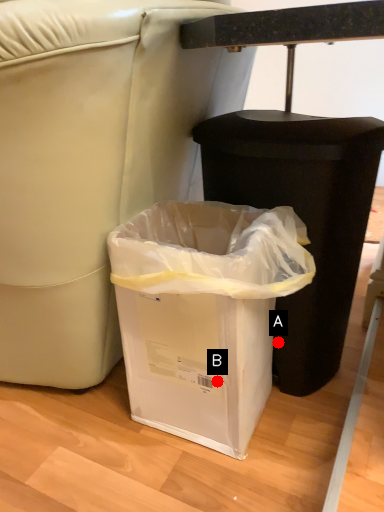
Question: Two points are circled on the image, labeled by A and B beside each circle. Which point is farther to the camera?

Choices:
 (A) A is further
 (B) B is further

Answer: (A)